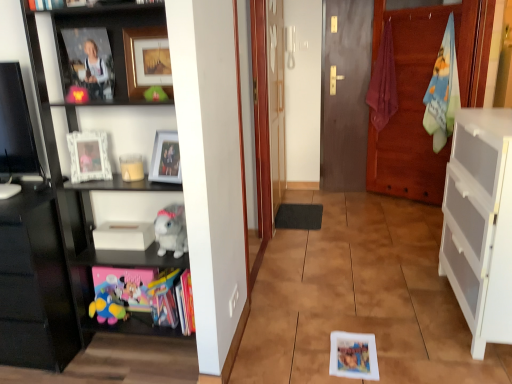
Question: Is gray plush toy at left situated inside white glossy picture frame at upper left, placed as the second picture frame when sorted from bottom to top, or outside?

Choices:
 (A) outside
 (B) inside

Answer: (A)

Question: Looking at their shapes, would you say gray plush toy at left is wider or thinner than white glossy picture frame at upper left, arranged as the 2th picture frame when viewed from the top?

Choices:
 (A) thin
 (B) wide

Answer: (B)

Question: Which of these objects is positioned farthest from the matte glass picture frame at upper center, the 1th picture frame in the bottom-to-top sequence?

Choices:
 (A) white matte cabinet at right, acting as the 2th cabinetry starting from the left
 (B) gray plush toy at left
 (C) green felt toy at upper center, the first toy from the front
 (D) soft plush toy at lower left, which ranks as the second toy in top-to-bottom order
 (E) gold metallic picture frame at upper center, the third picture frame ordered from the bottom

Answer: (A)

Question: Considering the real-world distances, which object is farthest from the matte glass picture frame at upper center, the 1th picture frame in the bottom-to-top sequence?

Choices:
 (A) white matte cabinet at right, acting as the 1th cabinetry starting from the right
 (B) gray plush toy at left
 (C) soft plush toy at lower left, which ranks as the second toy in right-to-left order
 (D) black glossy shelf at left
 (E) gold metallic picture frame at upper center, the third picture frame ordered from the bottom

Answer: (A)